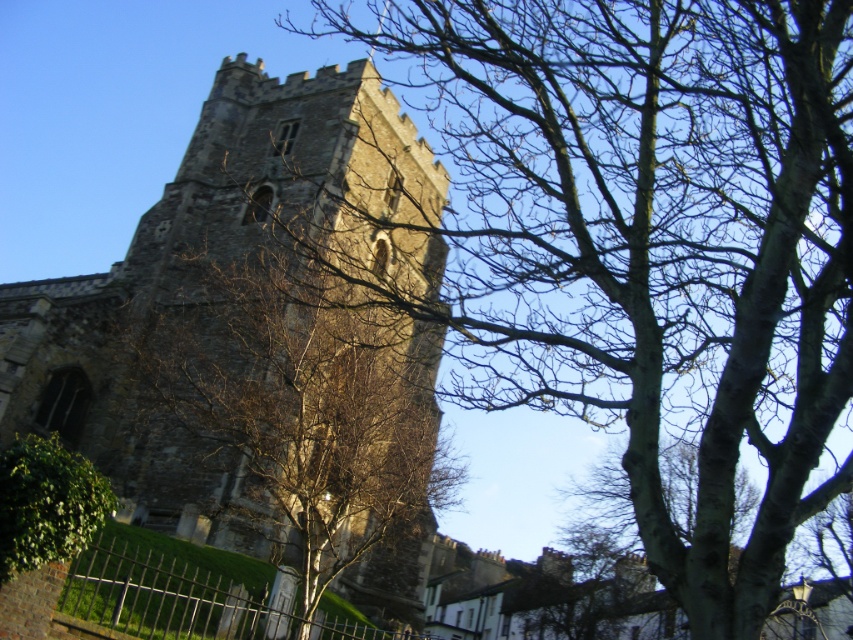
You are standing in a park and see the gray stone tower at center and the green leafy bush at lower left. Which object is positioned more to the east if the sun is setting in the west?

The gray stone tower at center is to the right of green leafy bush at lower left. Since the sun is setting in the west, the right side of the image faces east. Therefore, the gray stone tower at center is positioned more to the east compared to the green leafy bush at lower left.

You are standing at the base of the historic stone tower and notice two points marked on the tower wall. The first point is at coordinates point (x=757, y=618) and the second is at point (x=167, y=492). Which point is closer to you as you look up at the tower?

Point (x=757, y=618) is in front of point (x=167, y=492), so the first point is closer to you.